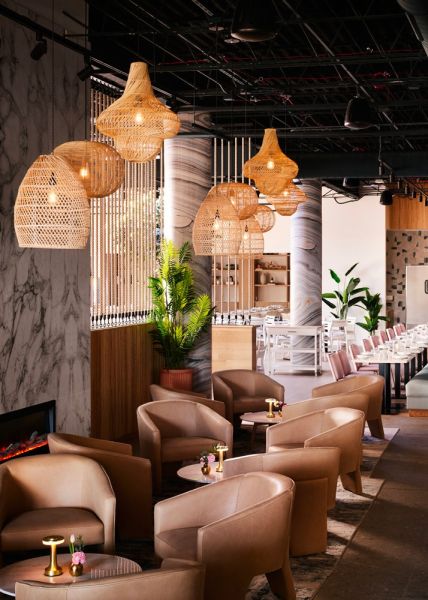
Identify the location of pink square chair. The image size is (428, 600). (336, 361), (341, 352), (355, 348), (367, 342), (375, 336), (385, 335), (391, 332), (398, 327), (402, 325).